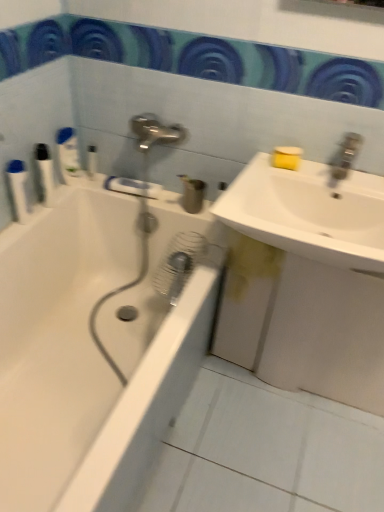
At what (x,y) coordinates should I click in order to perform the action: click on vacant space to the right of white plastic bottle at upper left, the third toiletry when ordered from left to right. Please return your answer as a coordinate pair (x, y). The height and width of the screenshot is (512, 384). Looking at the image, I should click on (104, 182).